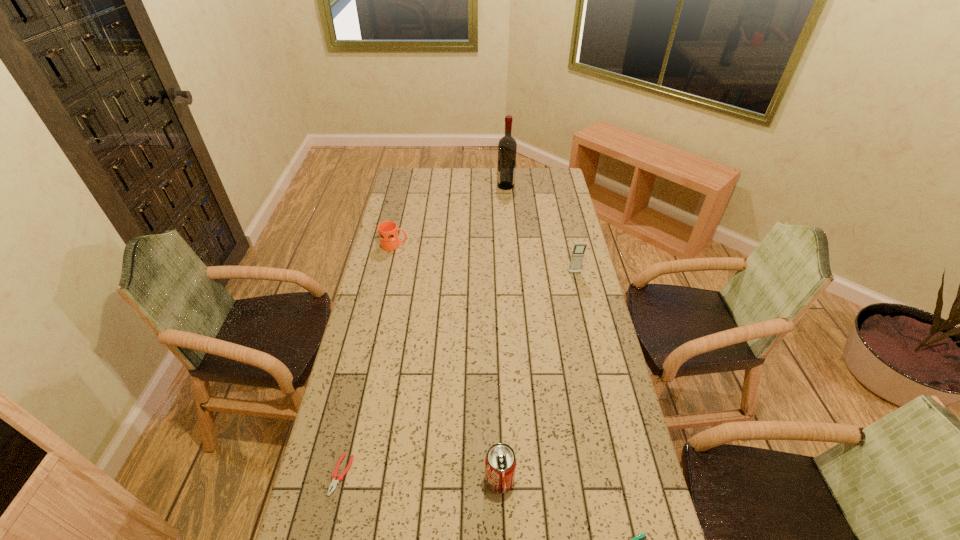
Find the location of a particular element. The height and width of the screenshot is (540, 960). free space located 0.060m on the front and back of the farthest object is located at coordinates (486, 186).

Where is `blank space located on the front-facing side of the fourth nearest object`? Image resolution: width=960 pixels, height=540 pixels. blank space located on the front-facing side of the fourth nearest object is located at coordinates (585, 314).

Where is `vacant space located 0.050m on the right of the pop soda`? The image size is (960, 540). vacant space located 0.050m on the right of the pop soda is located at coordinates (532, 480).

I want to click on free space located on the handle side of the fifth nearest object, so click(x=428, y=245).

Identify the location of free space located 0.080m on the back of the left pliers. (352, 428).

You are a GUI agent. You are given a task and a screenshot of the screen. Output one action in this format:
    pyautogui.click(x=<x>, y=<y>)
    Task: Click on the object at the far edge
    This screenshot has height=540, width=960.
    Given the screenshot: What is the action you would take?
    pyautogui.click(x=507, y=147)

Locate an element on the screen. mug located in the left edge section of the desktop is located at coordinates (388, 232).

The height and width of the screenshot is (540, 960). I want to click on pliers that is at the left edge, so click(335, 476).

In order to click on object that is positioned at the right edge in this screenshot , I will do `click(577, 256)`.

Find the location of `vacant region at the far edge of the desktop`. vacant region at the far edge of the desktop is located at coordinates (435, 184).